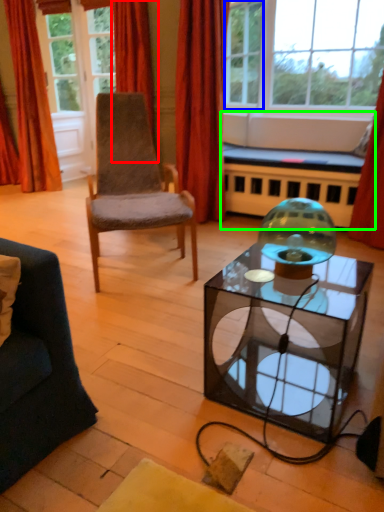
Question: Which object is positioned closest to curtain (highlighted by a red box)? Select from window (highlighted by a blue box) and couch (highlighted by a green box).

Choices:
 (A) window
 (B) couch

Answer: (B)